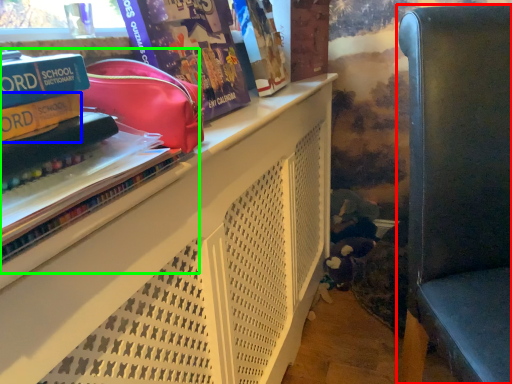
Question: Considering the real-world distances, which object is closest to furniture (highlighted by a red box)? paperback book (highlighted by a blue box) or book (highlighted by a green box).

Choices:
 (A) paperback book
 (B) book

Answer: (B)